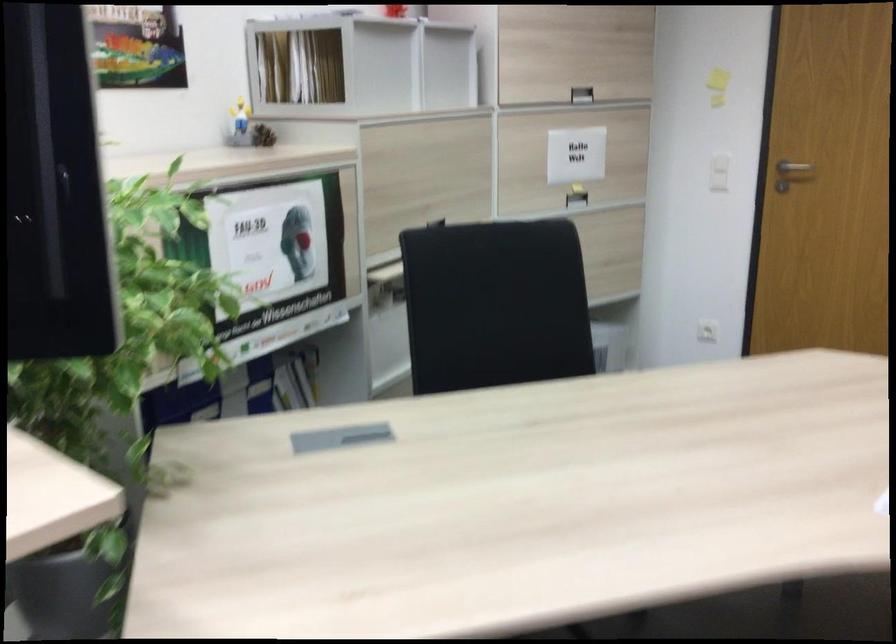
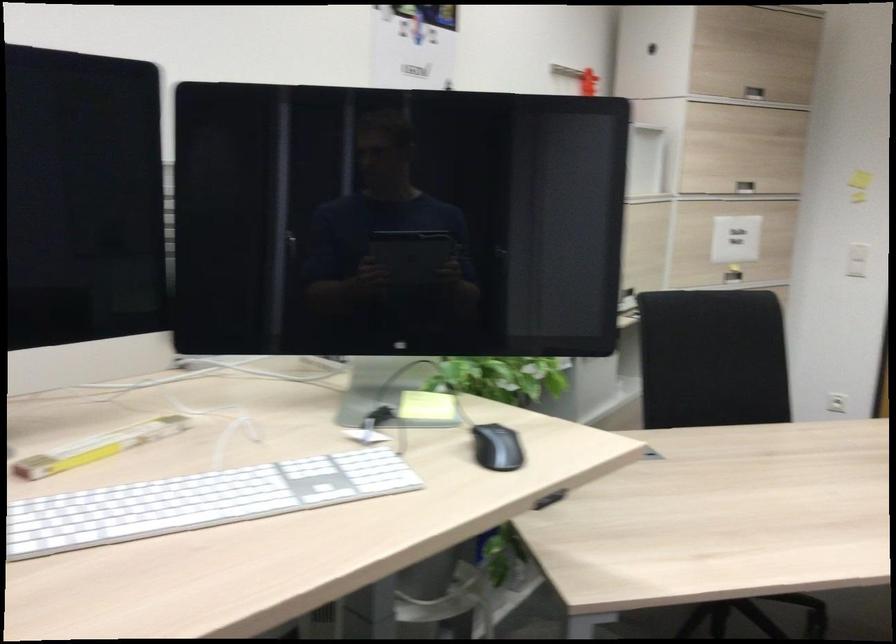
Where in the second image is the point corresponding to (487,304) from the first image?

(712, 359)